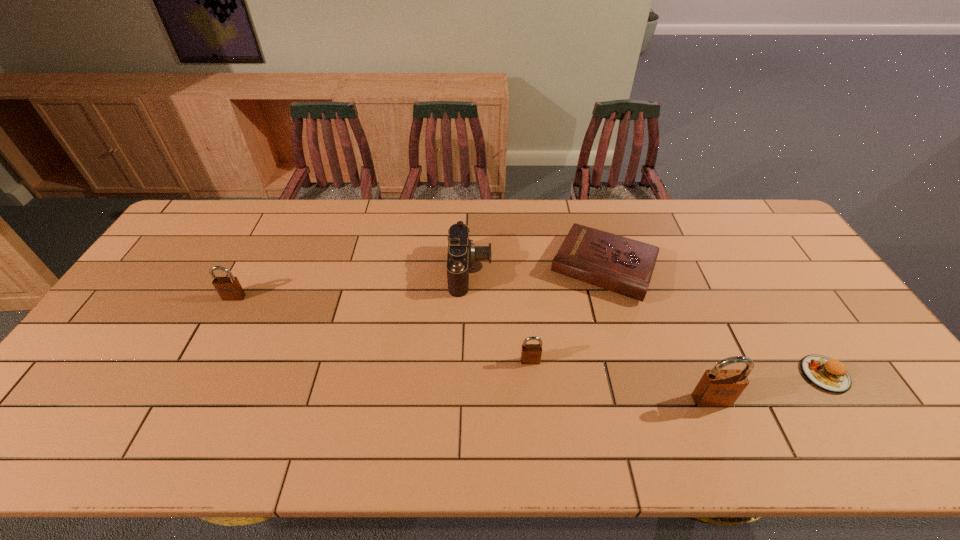
In the image, there is a desktop. Identify the location of vacant area at the far edge. Image resolution: width=960 pixels, height=540 pixels. (480, 207).

Find the location of a particular element. vacant space at the near edge of the desktop is located at coordinates (793, 399).

The image size is (960, 540). In the image, there is a desktop. What are the coordinates of `vacant region at the left edge` in the screenshot? It's located at (76, 374).

This screenshot has width=960, height=540. In the image, there is a desktop. Find the location of `vacant space at the right edge`. vacant space at the right edge is located at coordinates point(788,252).

Where is `vacant space at the near left corner of the desktop`? This screenshot has width=960, height=540. vacant space at the near left corner of the desktop is located at coordinates (77, 393).

You are a GUI agent. You are given a task and a screenshot of the screen. Output one action in this format:
    pyautogui.click(x=<x>, y=<y>)
    Task: Click on the free space at the far right corner of the desktop
    This screenshot has height=540, width=960.
    Given the screenshot: What is the action you would take?
    pyautogui.click(x=763, y=240)

Locate an element on the screen. free space between the tallest object and the hardback book is located at coordinates (658, 334).

The width and height of the screenshot is (960, 540). What are the coordinates of `unoccupied area between the fourth object from right to left and the shortest object` in the screenshot? It's located at (678, 368).

Image resolution: width=960 pixels, height=540 pixels. Identify the location of empty location between the camera and the hardback book. (538, 269).

The width and height of the screenshot is (960, 540). What are the coordinates of `free point between the second object from left to right and the second padlock from right to left` in the screenshot? It's located at (500, 316).